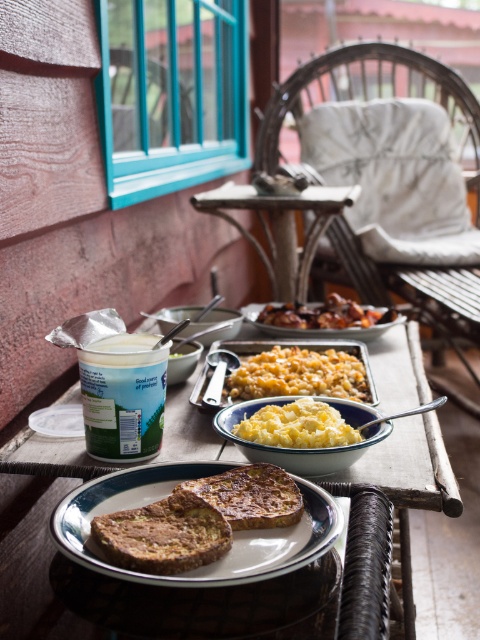
You are a chef preparing a breakfast tray and need to place the brown toasted bread at center and the green matte yogurt at center on a plate. Given that the plate has a diameter of 10 inches, will both items fit on the plate without overlapping?

The distance between the brown toasted bread at center and the green matte yogurt at center is 9.84 inches, which is slightly less than the plate diameter of 10 inches. Therefore, both items can fit on the plate without overlapping.

You are planning to serve a balanced meal and need to arrange the brown toasted bread at center and the golden crispy fried chicken at center on a small plate. Which item should you place first to ensure both fit properly?

The brown toasted bread at center is smaller in size compared to the golden crispy fried chicken at center, so you should place the golden crispy fried chicken at center first to ensure there is enough space for the smaller bread afterward.

You are planning to place a small vase between the brown toasted bread at center and the green matte yogurt at center on the table. Based on their widths, which item should you position closer to the edge of the table to ensure the vase fits?

The green matte yogurt at center has a narrower width compared to the brown toasted bread at center. Position the vase closer to the green matte yogurt at center to accommodate its smaller size, ensuring there is enough space between the two items.